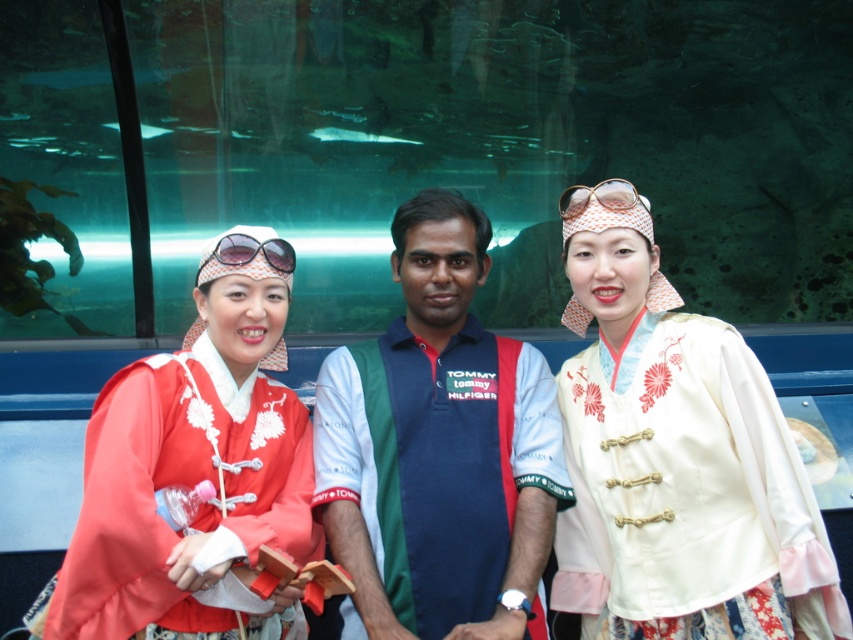
Which is in front, point (374, 392) or point (279, 260)?

Positioned in front is point (279, 260).

Identify the location of blue cotton shirt at center. This screenshot has width=853, height=640. (439, 449).

Who is more forward, (346, 548) or (230, 250)?

Point (346, 548) is in front.

You are a GUI agent. You are given a task and a screenshot of the screen. Output one action in this format:
    pyautogui.click(x=<x>, y=<y>)
    Task: Click on the blue cotton shirt at center
    The height and width of the screenshot is (640, 853).
    Given the screenshot: What is the action you would take?
    pyautogui.click(x=439, y=449)

Does blue cotton shirt at center have a greater height compared to gold textured goggles at center?

Yes, blue cotton shirt at center is taller than gold textured goggles at center.

Is point (466, 372) in front of point (566, 189)?

No, it is behind (566, 189).

Which is in front, point (386, 385) or point (604, 195)?

Positioned in front is point (604, 195).

The width and height of the screenshot is (853, 640). In order to click on blue cotton shirt at center in this screenshot , I will do `click(439, 449)`.

Can you confirm if matte red kimono at left is wider than blue cotton shirt at center?

Yes.

Is matte red kimono at left to the right of blue cotton shirt at center from the viewer's perspective?

Yes, matte red kimono at left is to the right of blue cotton shirt at center.

Is point (740, 346) farther from camera compared to point (415, 534)?

No, it is in front of (415, 534).

At what (x,y) coordinates should I click in order to perform the action: click on matte red kimono at left. Please return your answer as a coordinate pair (x, y). This screenshot has height=640, width=853. Looking at the image, I should click on (717, 410).